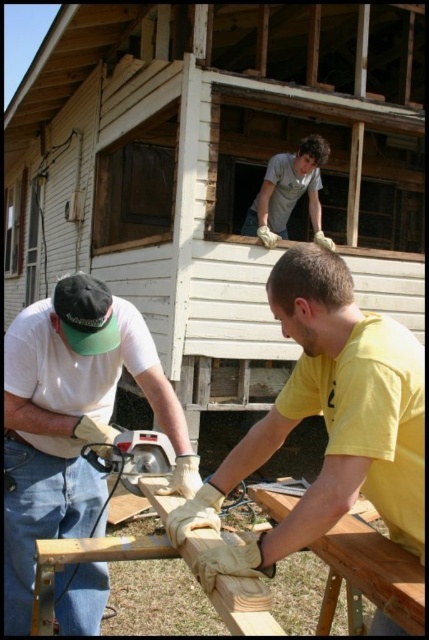
Question: Which object is farther from the camera taking this photo?

Choices:
 (A) light brown wooden plank at upper center
 (B) yellow matte shirt at lower right
 (C) matte white shirt at left

Answer: (A)

Question: Which of the following is the closest to the observer?

Choices:
 (A) (141, 442)
 (B) (45, 328)
 (C) (287, 404)
 (D) (311, 204)

Answer: (C)

Question: Which object appears farthest from the camera in this image?

Choices:
 (A) matte gray circular saw at lower left
 (B) light brown wooden plank at upper center

Answer: (B)

Question: Does yellow matte shirt at lower right have a greater width compared to matte gray circular saw at lower left?

Choices:
 (A) no
 (B) yes

Answer: (B)

Question: Does light brown wooden plank at upper center have a lesser width compared to matte gray circular saw at lower left?

Choices:
 (A) yes
 (B) no

Answer: (B)

Question: Does matte white shirt at left appear under light brown wooden plank at upper center?

Choices:
 (A) yes
 (B) no

Answer: (A)